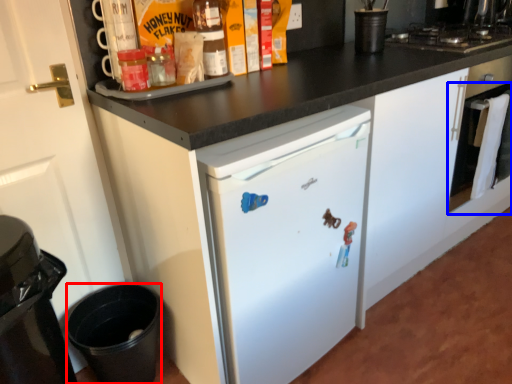
Question: Among these objects, which one is nearest to the camera, appliance (highlighted by a red box) or oven (highlighted by a blue box)?

Choices:
 (A) appliance
 (B) oven

Answer: (A)